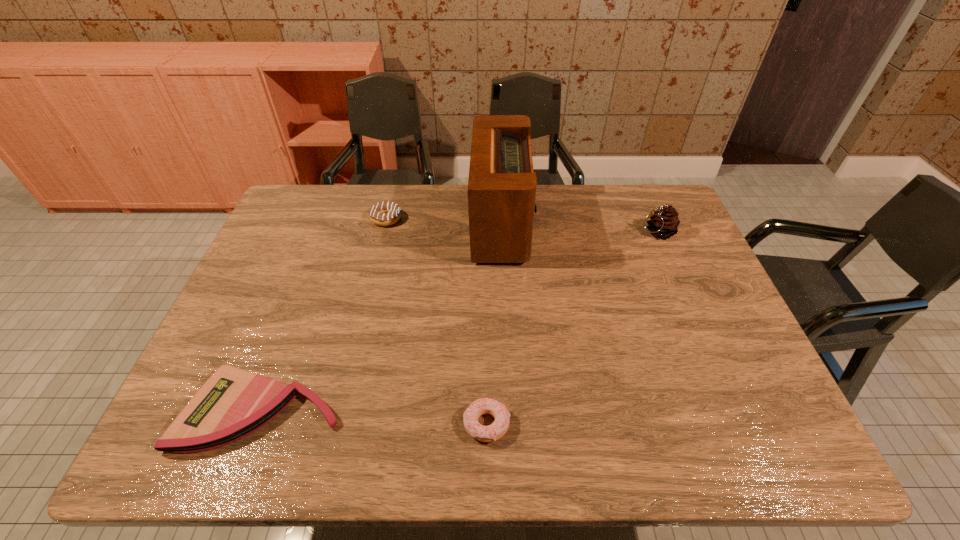
Locate an element on the screen. This screenshot has height=540, width=960. object that is positioned at the near left corner is located at coordinates (233, 403).

Image resolution: width=960 pixels, height=540 pixels. What are the coordinates of `object at the far right corner` in the screenshot? It's located at (664, 223).

Where is `vacant space at the far edge of the desktop`? vacant space at the far edge of the desktop is located at coordinates click(553, 215).

Where is `vacant space at the near edge of the desktop`? The height and width of the screenshot is (540, 960). vacant space at the near edge of the desktop is located at coordinates [x=277, y=431].

Find the location of a particular element. vacant space at the right edge is located at coordinates click(x=708, y=387).

Identify the location of vacant space at the far left corner of the desktop. This screenshot has height=540, width=960. (302, 197).

The width and height of the screenshot is (960, 540). In order to click on vacant space that is in between the farther doughnut and the wristlet in this screenshot , I will do `click(324, 314)`.

I want to click on empty space between the rightmost object and the wristlet, so click(459, 321).

At what (x,y) coordinates should I click in order to perform the action: click on vacant space that is in between the farther doughnut and the tallest object. Please return your answer as a coordinate pair (x, y). The width and height of the screenshot is (960, 540). Looking at the image, I should click on (444, 221).

The height and width of the screenshot is (540, 960). I want to click on unoccupied area between the wristlet and the tallest object, so click(382, 316).